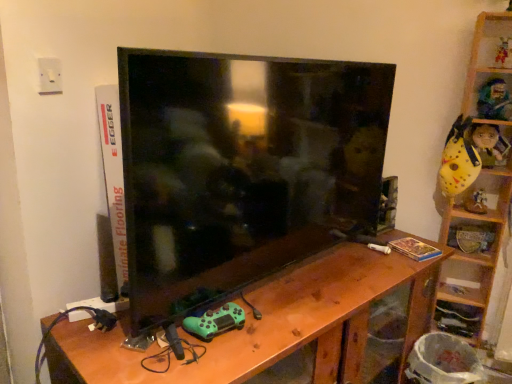
Question: Is white plastic electric outlet at upper left in front of wooden table at center?

Choices:
 (A) no
 (B) yes

Answer: (A)

Question: Would you say white plastic electric outlet at upper left is outside wooden table at center?

Choices:
 (A) yes
 (B) no

Answer: (A)

Question: Considering the relative sizes of white plastic electric outlet at upper left and wooden table at center in the image provided, is white plastic electric outlet at upper left shorter than wooden table at center?

Choices:
 (A) yes
 (B) no

Answer: (A)

Question: Is white plastic electric outlet at upper left beside wooden table at center?

Choices:
 (A) no
 (B) yes

Answer: (A)

Question: Are white plastic electric outlet at upper left and wooden table at center located far from each other?

Choices:
 (A) yes
 (B) no

Answer: (B)

Question: Does white plastic electric outlet at upper left appear on the right side of wooden table at center?

Choices:
 (A) no
 (B) yes

Answer: (A)

Question: Would you say matte yellow plush toy at upper right, the 2th toy when ordered from back to front, contains wooden at right, positioned as the first shelf in top-to-bottom order?

Choices:
 (A) no
 (B) yes

Answer: (A)

Question: From a real-world perspective, is matte yellow plush toy at upper right, the 4th toy positioned from the left, located higher than wooden at right, which is the second shelf from bottom to top?

Choices:
 (A) yes
 (B) no

Answer: (A)

Question: Is the position of matte yellow plush toy at upper right, the 2th toy when ordered from back to front, less distant than that of wooden at right, which is the second shelf from bottom to top?

Choices:
 (A) yes
 (B) no

Answer: (B)

Question: Is matte yellow plush toy at upper right, the 4th toy viewed from the front, oriented towards wooden at right, which is the second shelf from bottom to top?

Choices:
 (A) yes
 (B) no

Answer: (A)

Question: Is matte yellow plush toy at upper right, the 4th toy positioned from the left, at the left side of wooden at right, positioned as the first shelf in top-to-bottom order?

Choices:
 (A) yes
 (B) no

Answer: (B)

Question: Is matte yellow plush toy at upper right, the 4th toy viewed from the front, outside of wooden at right, which is the second shelf from bottom to top?

Choices:
 (A) yes
 (B) no

Answer: (B)

Question: Does green matte controller at lower center, which ranks as the 1th toy in front-to-back order, have a greater height compared to wooden at right, the 2th shelf positioned from the top?

Choices:
 (A) yes
 (B) no

Answer: (B)